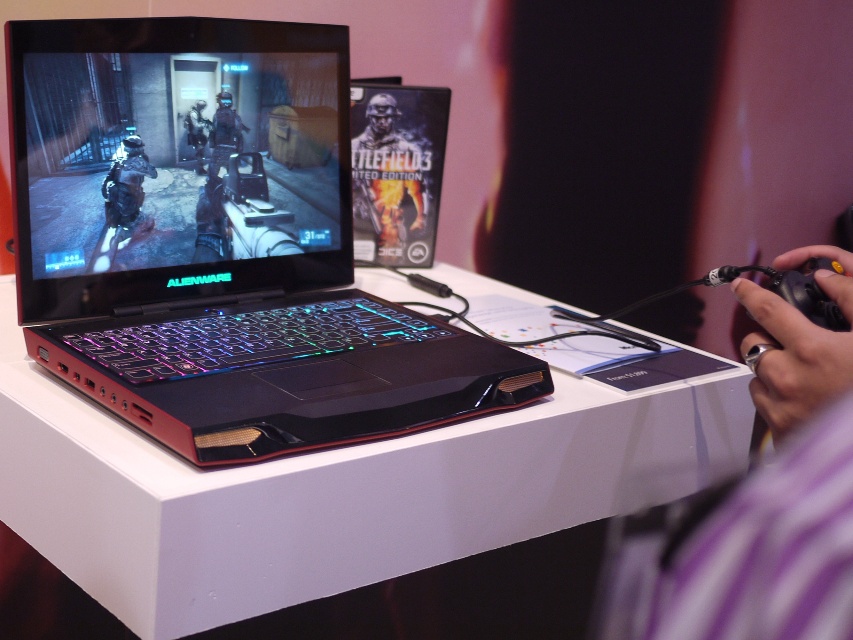
You are a gamer trying to reach both points on your gaming setup. Which point, point (28, 310) or point (784, 257), is closer to you?

Point (28, 310) is closer to you because it is further to the viewer than point (784, 257).

Where is the matte black laptop at center located in the image?

The matte black laptop at center is located at point (216, 243).

You are setting up a new gaming desk and need to ensure that the matte black laptop at center can fit on the white glossy table at center. Based on their heights, will the laptop fit on the table?

The matte black laptop at center is taller than the white glossy table at center. This means the laptop cannot fit on the table because it is taller than the table itself.